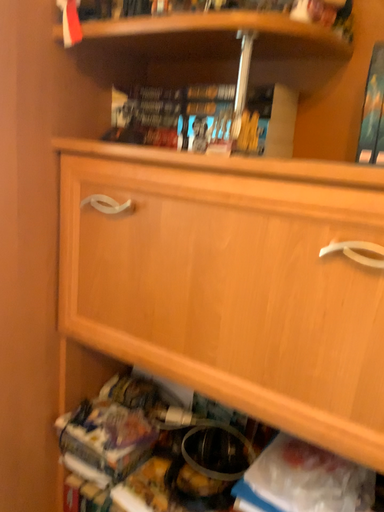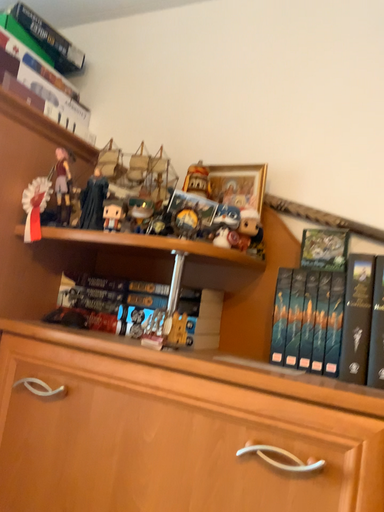
Question: Which way did the camera rotate in the video?

Choices:
 (A) rotated downward
 (B) rotated upward

Answer: (B)